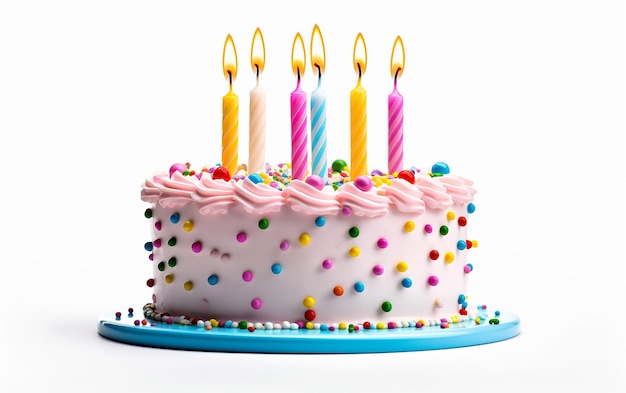
I want to click on number of candles, so pos(401,118), pos(357,128), pos(320,114), pos(299,143), pos(258,135), pos(228,139).